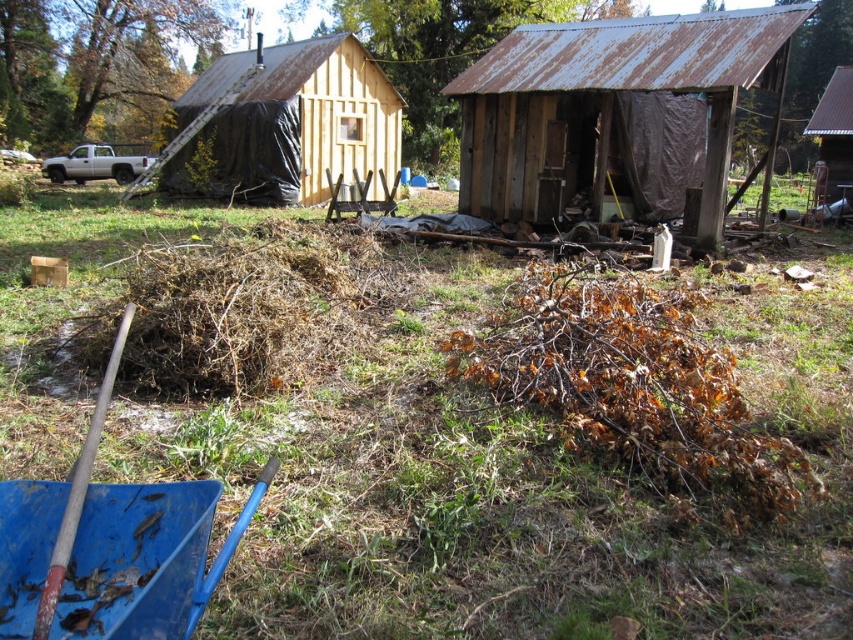
Question: Among these points, which one is nearest to the camera?

Choices:
 (A) (113, 362)
 (B) (631, 74)
 (C) (328, 452)

Answer: (C)

Question: Does rusty metal hut at center come behind metallic corrugated roof at upper right?

Choices:
 (A) no
 (B) yes

Answer: (A)

Question: Estimate the real-world distances between objects in this image. Which object is farther from the green grass at center?

Choices:
 (A) rusty metal hut at center
 (B) metallic corrugated roof at upper right

Answer: (B)

Question: Does wooden hut at center lie in front of metallic corrugated roof at upper right?

Choices:
 (A) yes
 (B) no

Answer: (A)

Question: Which object is positioned farthest from the rusty metal shovel at lower left?

Choices:
 (A) rusty metal hut at center
 (B) green grass at center
 (C) metallic corrugated roof at upper right
 (D) wooden hut at center

Answer: (C)

Question: Is rusty metal hut at center smaller than metallic corrugated roof at upper right?

Choices:
 (A) no
 (B) yes

Answer: (B)